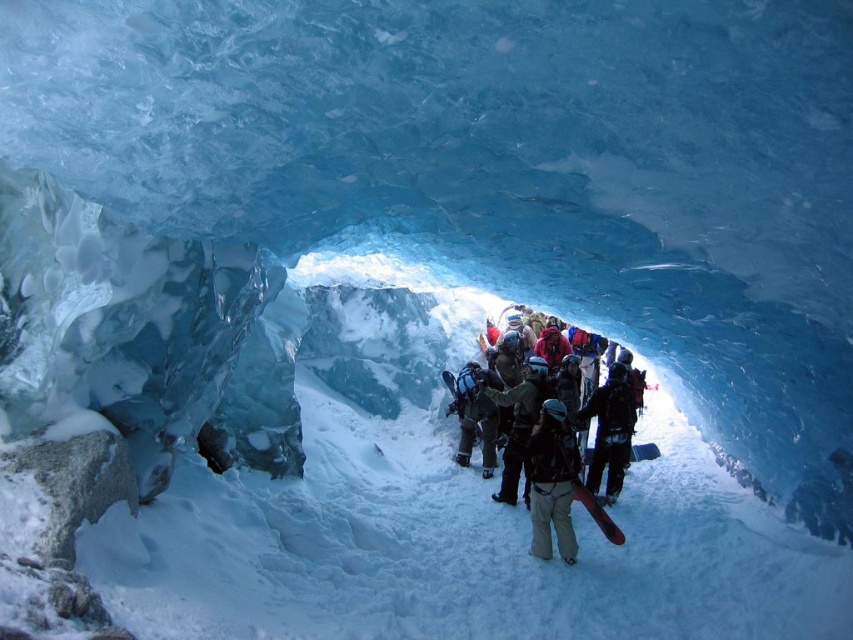
Question: Which point is farther to the camera?

Choices:
 (A) (537, 483)
 (B) (541, 385)

Answer: (B)

Question: Does matte black jacket at center lie behind dark brown leather jacket at center?

Choices:
 (A) yes
 (B) no

Answer: (B)

Question: Is matte black jacket at center bigger than dark brown leather jacket at center?

Choices:
 (A) no
 (B) yes

Answer: (B)

Question: Which point is farther to the camera?

Choices:
 (A) matte black jacket at center
 (B) dark brown leather jacket at center

Answer: (B)

Question: Is matte black jacket at center to the right of dark brown leather jacket at center from the viewer's perspective?

Choices:
 (A) yes
 (B) no

Answer: (B)